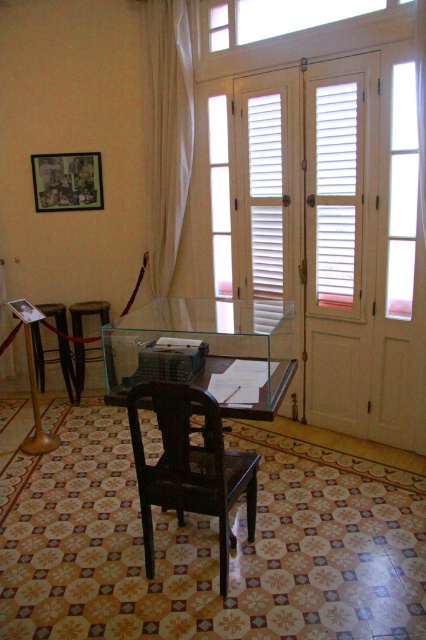
Is transparent glass table at center closer to the viewer compared to white wooden shutter at center?

Yes, it is.

Identify the location of transparent glass table at center. This screenshot has height=640, width=426. (207, 349).

Which is behind, point (252, 336) or point (344, 129)?

The point (252, 336) is behind.

This screenshot has width=426, height=640. What are the coordinates of `transparent glass table at center` in the screenshot? It's located at (207, 349).

Which is more to the right, white wooden shutter at center or white wooden window at upper center?

From the viewer's perspective, white wooden shutter at center appears more on the right side.

Is white wooden shutter at center closer to camera compared to white wooden window at upper center?

No, it is not.

Does point (345, 131) come in front of point (385, 3)?

No, (345, 131) is further to viewer.

Find the location of a particular element. The height and width of the screenshot is (640, 426). white wooden shutter at center is located at coordinates (336, 193).

Who is taller, black wicker chair at center or white sheer curtain at upper left?

With more height is white sheer curtain at upper left.

Can you confirm if black wicker chair at center is positioned below white sheer curtain at upper left?

Yes, black wicker chair at center is below white sheer curtain at upper left.

This screenshot has width=426, height=640. Identify the location of black wicker chair at center. (189, 467).

Identify the location of black wicker chair at center. (189, 467).